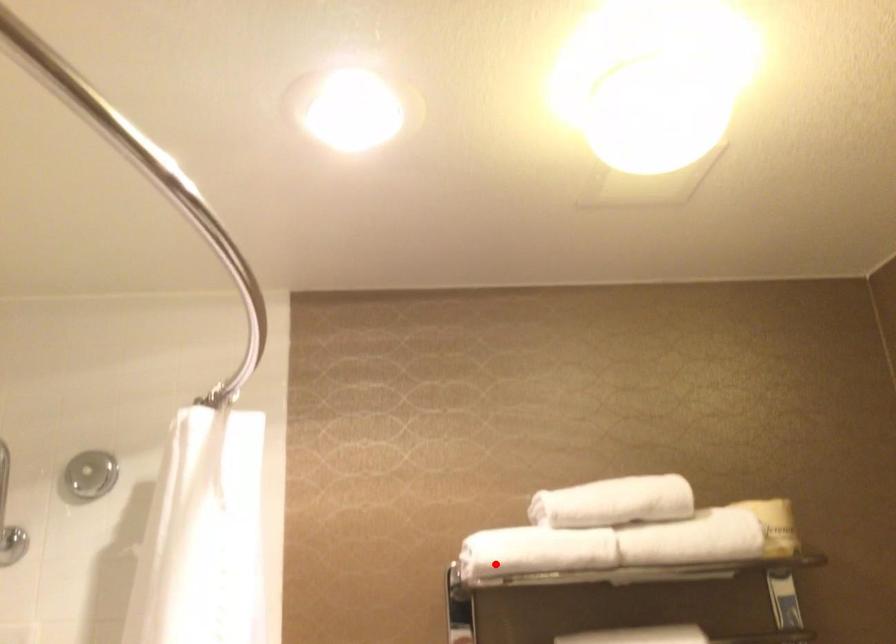
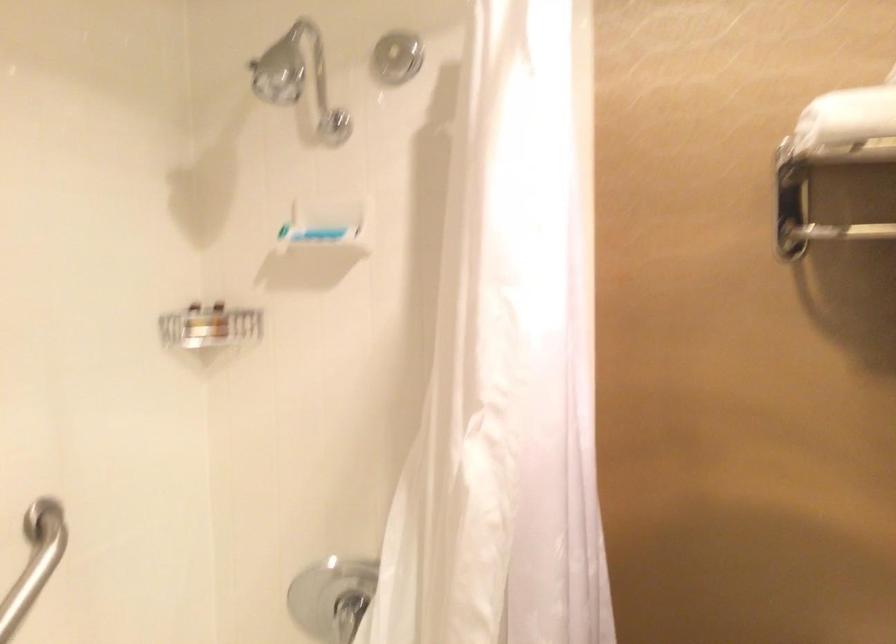
Question: I am providing you with two images of the same scene from different viewpoints. A red point is shown in image1. For the corresponding object point in image2, is it positioned nearer or farther from the camera?

Choices:
 (A) Nearer
 (B) Farther

Answer: (A)